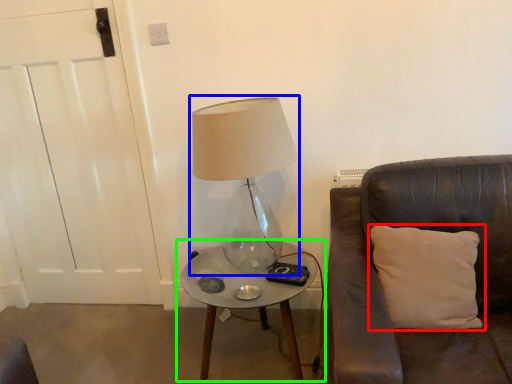
Question: Which object is positioned closest to pillow (highlighted by a red box)? Select from lamp (highlighted by a blue box) and table (highlighted by a green box).

Choices:
 (A) lamp
 (B) table

Answer: (B)